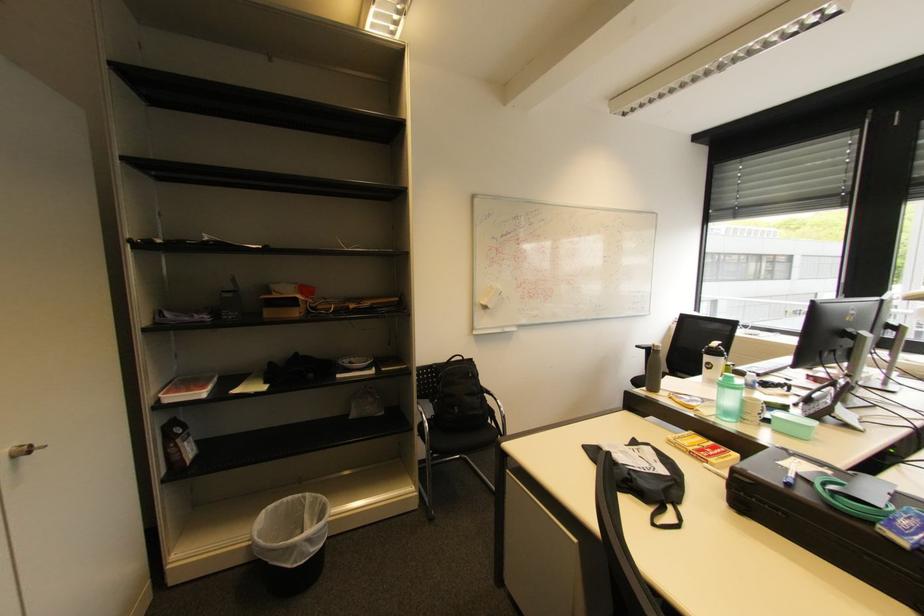
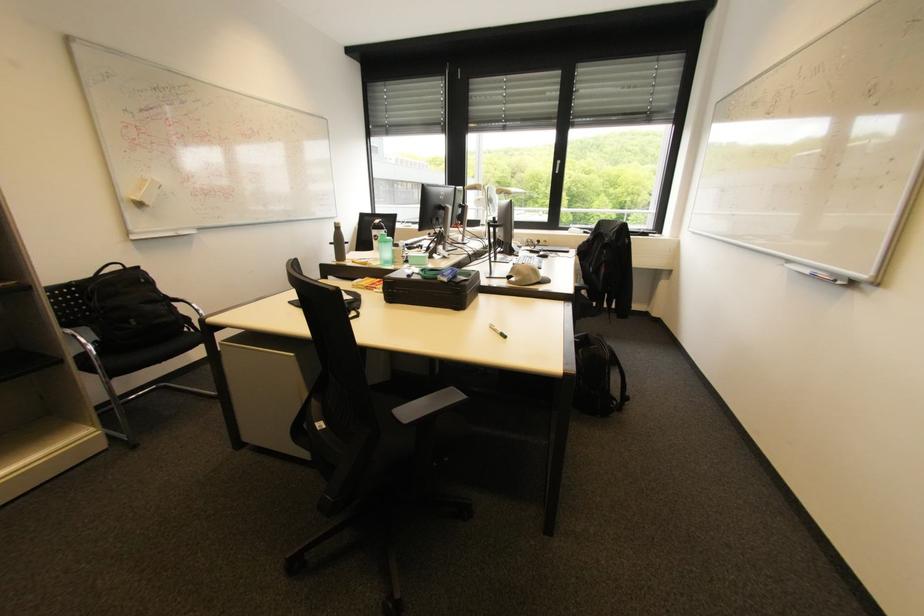
Find the pixel in the second image that matches (641,347) in the first image.

(335, 244)